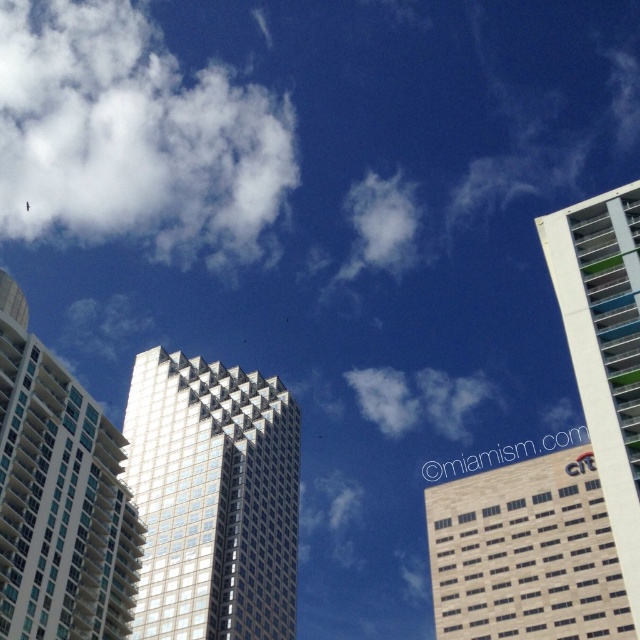
Is white fluffy cloud at upper left to the right of beige brick building at center from the viewer's perspective?

No, white fluffy cloud at upper left is not to the right of beige brick building at center.

Does point (13, 83) lie behind point (548, 477)?

Yes, it is behind point (548, 477).

The image size is (640, 640). What are the coordinates of `white fluffy cloud at upper left` in the screenshot? It's located at (132, 138).

Does point (106, 3) come behind point (32, 536)?

Yes.

Can you confirm if white fluffy cloud at upper left is bigger than white glass building at center?

Yes.

Which is in front, point (284, 97) or point (61, 592)?

Point (61, 592)

Where is `white fluffy cloud at upper left`? Image resolution: width=640 pixels, height=640 pixels. white fluffy cloud at upper left is located at coordinates (132, 138).

Is metallic glass skyscraper at center to the left of white glass building at center from the viewer's perspective?

No, metallic glass skyscraper at center is not to the left of white glass building at center.

Does metallic glass skyscraper at center lie behind white glass building at center?

Yes, it is.

What do you see at coordinates (212, 499) in the screenshot? I see `metallic glass skyscraper at center` at bounding box center [212, 499].

Locate an element on the screen. This screenshot has width=640, height=640. metallic glass skyscraper at center is located at coordinates (212, 499).